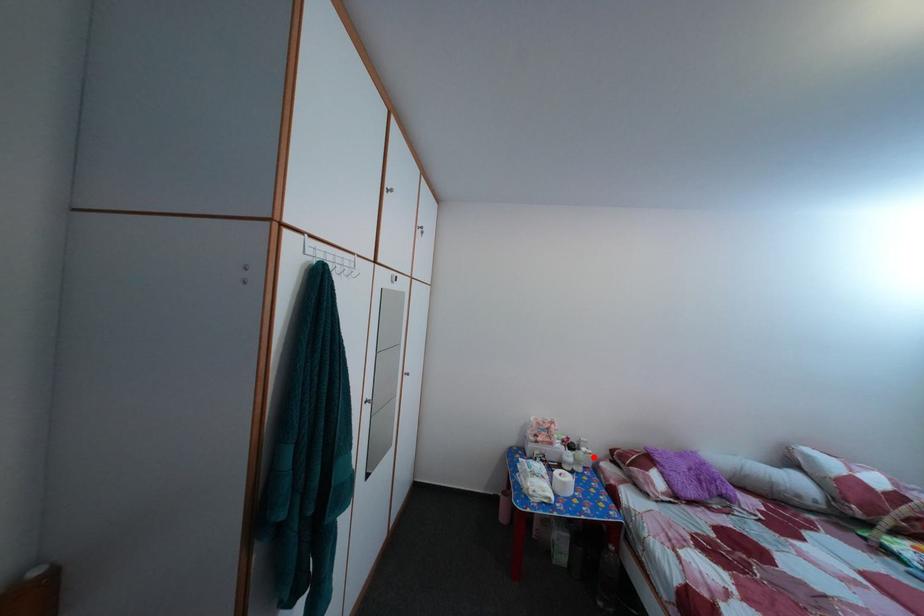
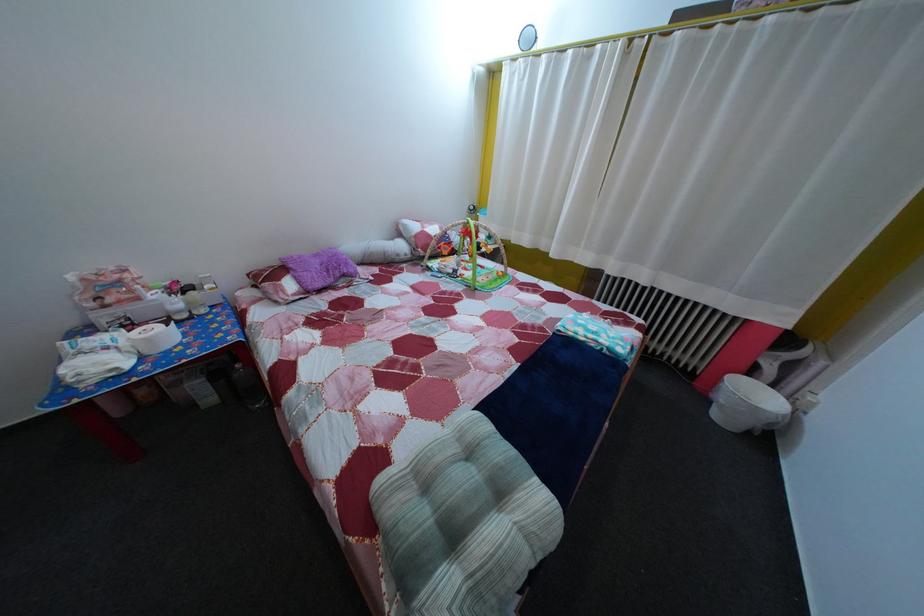
Locate, in the second image, the point that corresponds to the highlighted location in the first image.

(216, 294)